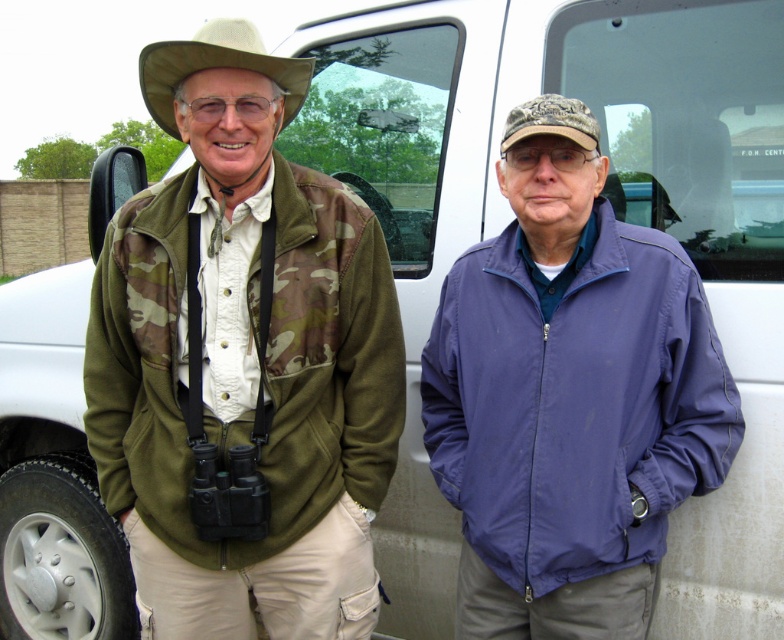
Which of these two, camo fabric jacket at left or camo fabric cap at center, stands taller?

With more height is camo fabric jacket at left.

Based on the photo, does camo fabric jacket at left appear over camo fabric cap at center?

No.

What do you see at coordinates (242, 362) in the screenshot?
I see `camo fabric jacket at left` at bounding box center [242, 362].

You are a GUI agent. You are given a task and a screenshot of the screen. Output one action in this format:
    pyautogui.click(x=<x>, y=<y>)
    Task: Click on the camo fabric jacket at left
    This screenshot has width=784, height=640.
    Given the screenshot: What is the action you would take?
    pyautogui.click(x=242, y=362)

I want to click on camo fabric jacket at left, so click(242, 362).

Does camo fabric jacket at left have a larger size compared to purple nylon jacket at center?

Yes.

I want to click on camo fabric jacket at left, so click(242, 362).

Which is in front, point (162, 116) or point (521, 132)?

Point (521, 132)

Between tan/cotton cowboy hat at upper left and camo fabric cap at center, which one has more height?

tan/cotton cowboy hat at upper left

Does point (274, 60) lie in front of point (545, 125)?

No.

The height and width of the screenshot is (640, 784). In order to click on tan/cotton cowboy hat at upper left in this screenshot , I will do `click(216, 67)`.